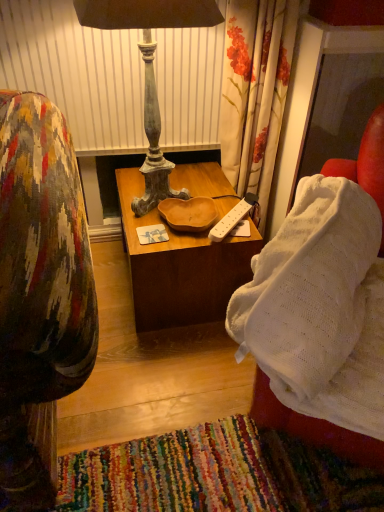
Question: Does distressed wood lamp at center appear on the left side of white knitted blanket at right?

Choices:
 (A) yes
 (B) no

Answer: (A)

Question: Is distressed wood lamp at center far from white knitted blanket at right?

Choices:
 (A) yes
 (B) no

Answer: (B)

Question: Could you tell me if distressed wood lamp at center is turned towards white knitted blanket at right?

Choices:
 (A) yes
 (B) no

Answer: (A)

Question: Is distressed wood lamp at center outside white knitted blanket at right?

Choices:
 (A) yes
 (B) no

Answer: (A)

Question: From the image's perspective, does distressed wood lamp at center appear higher than white knitted blanket at right?

Choices:
 (A) yes
 (B) no

Answer: (A)

Question: Is wooden table at center inside the boundaries of distressed wood lamp at center, or outside?

Choices:
 (A) inside
 (B) outside

Answer: (B)

Question: From a real-world perspective, is wooden table at center positioned above or below distressed wood lamp at center?

Choices:
 (A) above
 (B) below

Answer: (B)

Question: In terms of size, does wooden table at center appear bigger or smaller than distressed wood lamp at center?

Choices:
 (A) small
 (B) big

Answer: (B)

Question: Would you say wooden table at center is to the left or to the right of distressed wood lamp at center in the picture?

Choices:
 (A) right
 (B) left

Answer: (A)

Question: From a real-world perspective, is white knitted blanket at right above or below wooden table at center?

Choices:
 (A) above
 (B) below

Answer: (A)

Question: Considering the positions of white knitted blanket at right and wooden table at center in the image, is white knitted blanket at right wider or thinner than wooden table at center?

Choices:
 (A) thin
 (B) wide

Answer: (A)

Question: From the image's perspective, is white knitted blanket at right above or below wooden table at center?

Choices:
 (A) below
 (B) above

Answer: (A)

Question: Do you think white knitted blanket at right is within wooden table at center, or outside of it?

Choices:
 (A) outside
 (B) inside

Answer: (A)

Question: In terms of height, does distressed wood lamp at center look taller or shorter compared to wooden table at center?

Choices:
 (A) tall
 (B) short

Answer: (A)

Question: Considering the positions of distressed wood lamp at center and wooden table at center in the image, is distressed wood lamp at center wider or thinner than wooden table at center?

Choices:
 (A) wide
 (B) thin

Answer: (B)